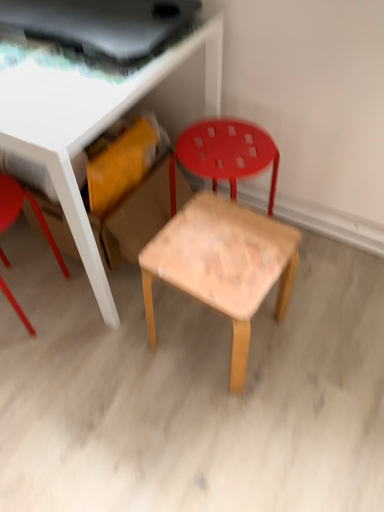
You are a GUI agent. You are given a task and a screenshot of the screen. Output one action in this format:
    pyautogui.click(x=<x>, y=<y>)
    Task: Click on the vacant region to the right of matte red stool at left, which is the 2th chair from right to left
    Image resolution: width=384 pixels, height=512 pixels.
    Given the screenshot: What is the action you would take?
    pyautogui.click(x=89, y=310)